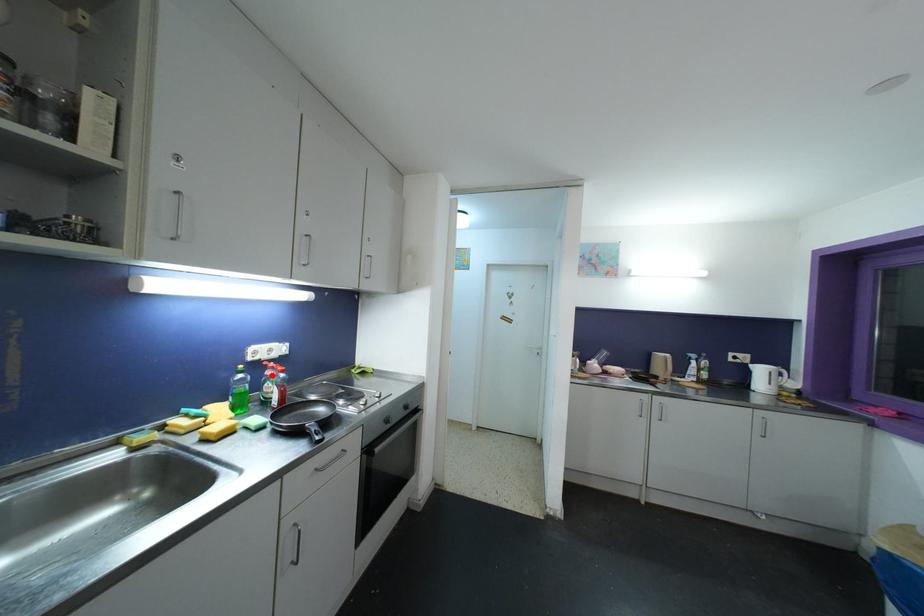
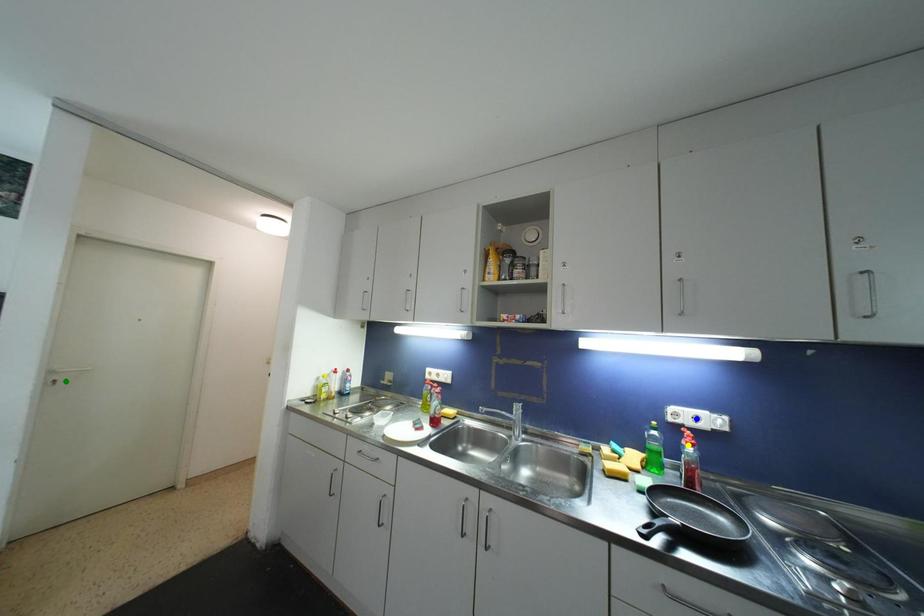
Question: I am providing you with two images of the same scene from different viewpoints. A red point is marked on the first image. You are given multiple points on the second image. Which point in image 2 is actually the same real-world point as the red point in image 1?

Choices:
 (A) yellow point
 (B) green point
 (C) blue point

Answer: (A)